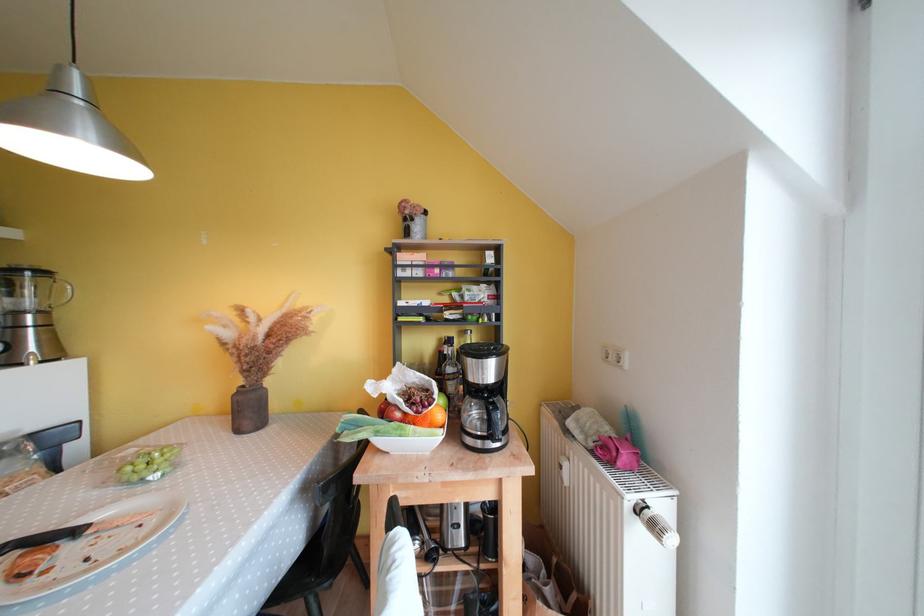
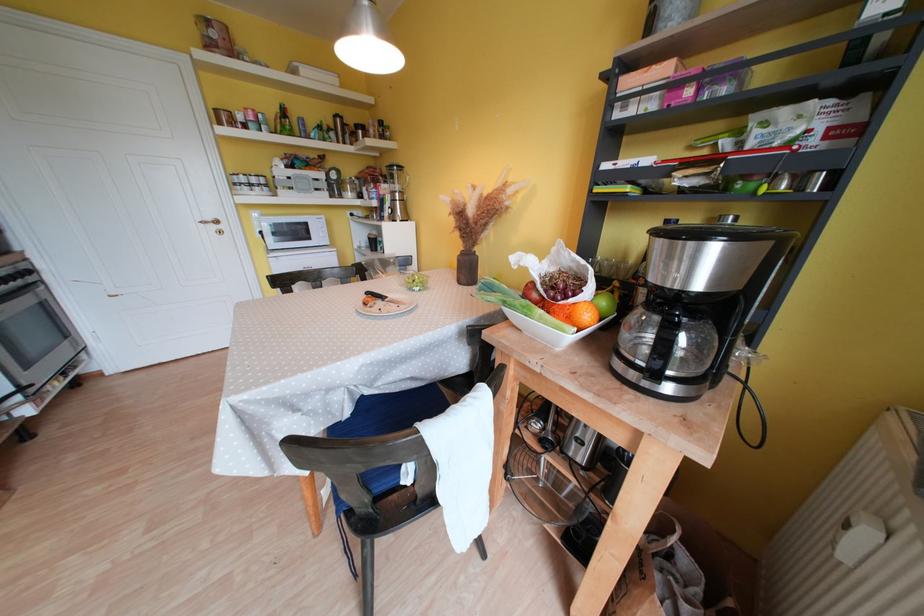
Locate, in the second image, the point that corresponds to point (436, 411) in the first image.

(578, 302)